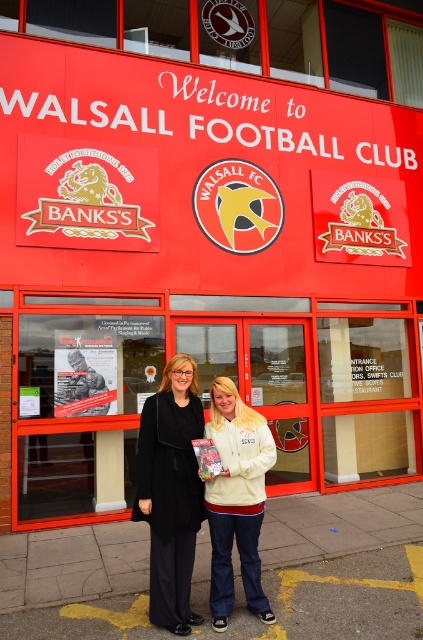
Which of these two, red matte building at center or white fleece jacket at center, stands taller?

white fleece jacket at center is taller.

Locate an element on the screen. The height and width of the screenshot is (640, 423). red matte building at center is located at coordinates (208, 390).

Does white fleece jacket at center appear over black fabric coat at center?

Incorrect, white fleece jacket at center is not positioned above black fabric coat at center.

Looking at this image, is white fleece jacket at center to the left of black fabric coat at center from the viewer's perspective?

In fact, white fleece jacket at center is to the right of black fabric coat at center.

Which is in front, point (258, 564) or point (142, 508)?

Point (142, 508)

In order to click on white fleece jacket at center in this screenshot , I will do `click(236, 499)`.

Is red matte building at center positioned behind black fabric coat at center?

Yes, it is.

In the scene shown: Is red matte building at center taller than black fabric coat at center?

Yes.

Between point (68, 380) and point (195, 365), which one is positioned in front?

Point (195, 365)

Find the location of `red matte building at center`. red matte building at center is located at coordinates (208, 390).